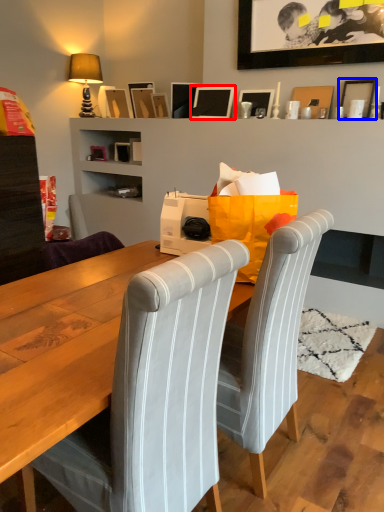
Question: Which object is further to the camera taking this photo, picture frame (highlighted by a red box) or picture frame (highlighted by a blue box)?

Choices:
 (A) picture frame
 (B) picture frame

Answer: (A)